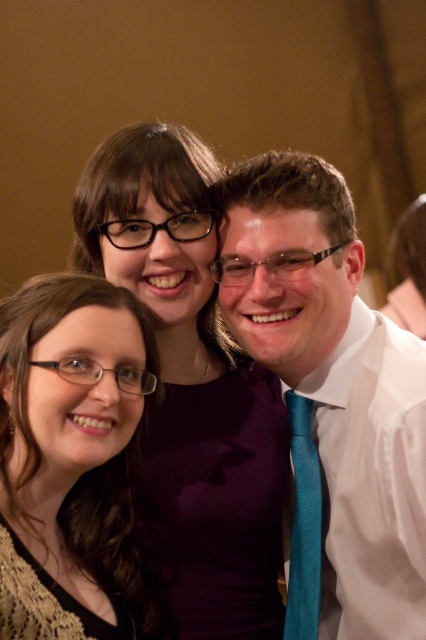
Question: Among these objects, which one is farthest from the camera?

Choices:
 (A) white glossy shirt at center
 (B) purple fabric dress at center
 (C) teal silk tie at right

Answer: (C)

Question: Does white glossy shirt at center have a lesser width compared to matte black glasses at lower left?

Choices:
 (A) no
 (B) yes

Answer: (A)

Question: Considering the relative positions of white glossy shirt at center and teal silk tie at right in the image provided, where is white glossy shirt at center located with respect to teal silk tie at right?

Choices:
 (A) left
 (B) right

Answer: (B)

Question: Which of these objects is positioned closest to the matte black glasses at lower left?

Choices:
 (A) purple fabric dress at center
 (B) teal silk tie at right

Answer: (A)

Question: Which point is farther to the camera?

Choices:
 (A) white glossy shirt at center
 (B) teal silk tie at right
 (C) purple fabric dress at center
 (D) matte black glasses at lower left

Answer: (B)

Question: Is purple fabric dress at center to the left of matte black glasses at lower left from the viewer's perspective?

Choices:
 (A) yes
 (B) no

Answer: (B)